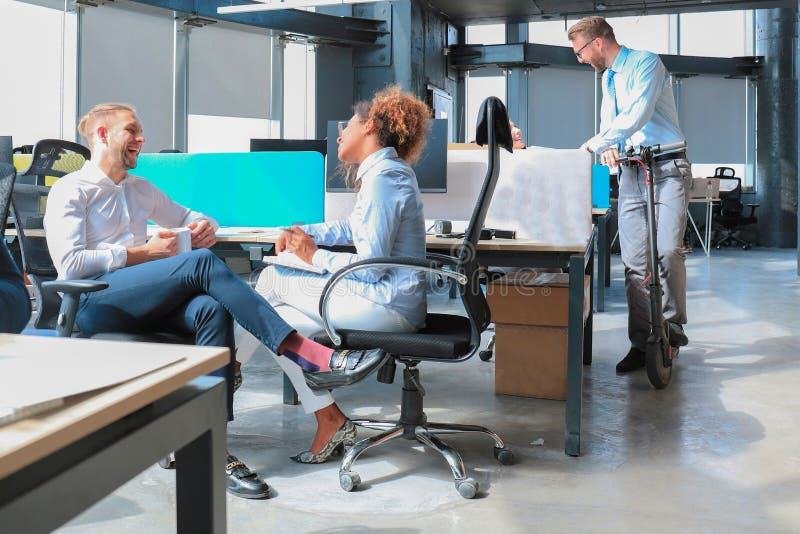
The width and height of the screenshot is (800, 534). Find the location of `rolling chair`. rolling chair is located at coordinates (448, 342), (498, 121), (409, 408), (466, 480).